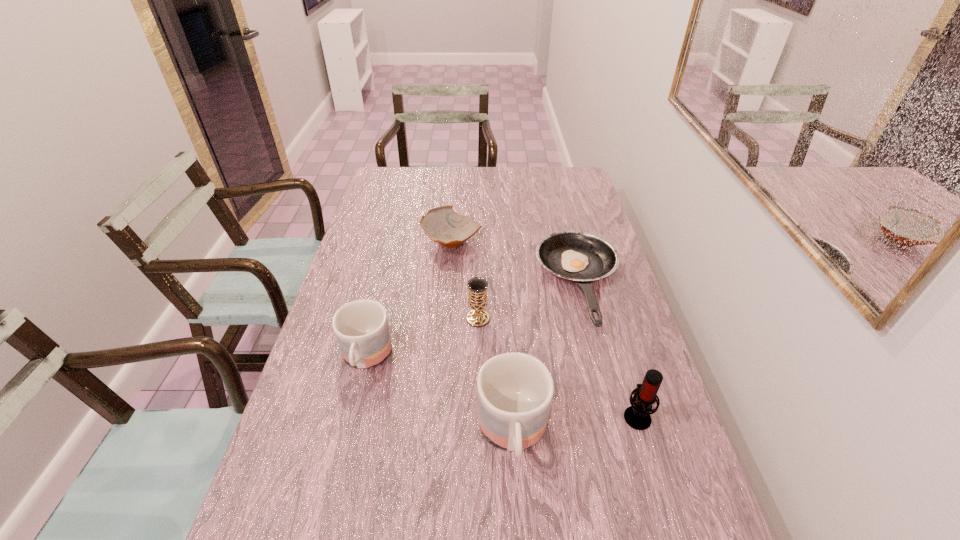
At what (x,y) coordinates should I click in order to perform the action: click on the farther mug. Please return your answer as a coordinate pair (x, y). The width and height of the screenshot is (960, 540). Looking at the image, I should click on (361, 327).

Image resolution: width=960 pixels, height=540 pixels. Find the location of `the leftmost object`. the leftmost object is located at coordinates (361, 327).

Where is `the nearer mug`? The width and height of the screenshot is (960, 540). the nearer mug is located at coordinates (515, 390).

Identify the location of the right mug. This screenshot has width=960, height=540. (515, 390).

What are the coordinates of `the second shortest object` in the screenshot? It's located at (442, 224).

Where is `the shortest object`? The width and height of the screenshot is (960, 540). the shortest object is located at coordinates (580, 257).

I want to click on microphone, so click(637, 416).

I want to click on chalice, so click(477, 286).

Where is `vacant space located 0.330m on the side with the handle of the leftmost object`? vacant space located 0.330m on the side with the handle of the leftmost object is located at coordinates (324, 531).

Where is `free location located 0.060m on the side with the handle of the right mug`? free location located 0.060m on the side with the handle of the right mug is located at coordinates (517, 514).